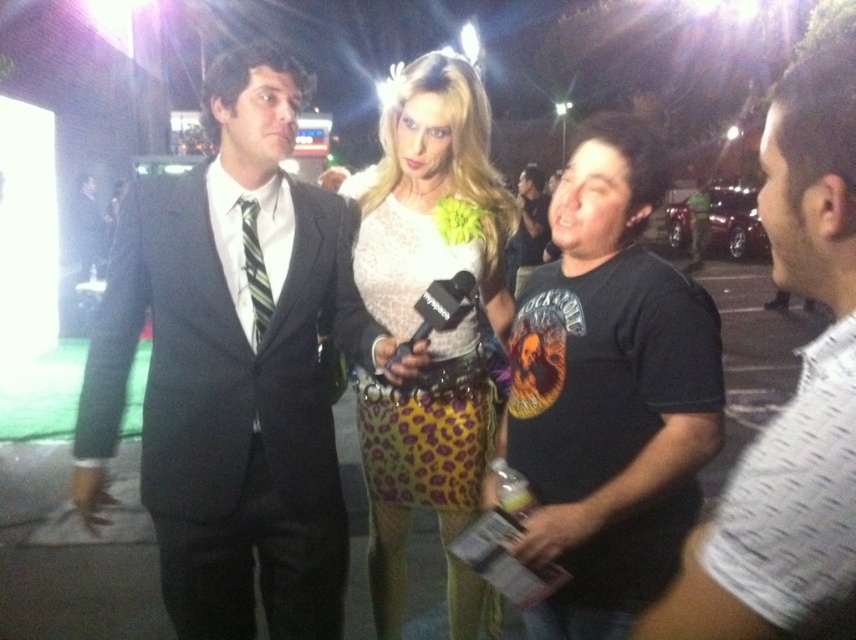
You are a photographer at the event and need to position yourself so that both the matte black suit at left and the white textured shirt at right are visible in your frame. Based on their positions, which side of the two should you stand closer to?

You should stand closer to the right side because the matte black suit at left is to the left of the white textured shirt at right, so positioning yourself to the right will keep both subjects within the frame without one being cut off.